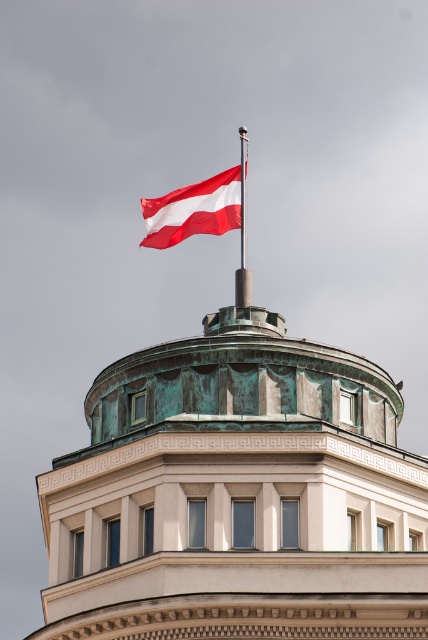
Question: Where is red fabric flag at upper center located in relation to red flagpole at top in the image?

Choices:
 (A) above
 (B) below

Answer: (B)

Question: Among these points, which one is farthest from the camera?

Choices:
 (A) (244, 234)
 (B) (223, 212)

Answer: (A)

Question: From the image, what is the correct spatial relationship of red fabric flag at upper center in relation to red flagpole at top?

Choices:
 (A) above
 (B) below

Answer: (B)

Question: Which object is farther from the camera taking this photo?

Choices:
 (A) red flagpole at top
 (B) red fabric flag at upper center

Answer: (B)

Question: In this image, where is red fabric flag at upper center located relative to red flagpole at top?

Choices:
 (A) left
 (B) right

Answer: (A)